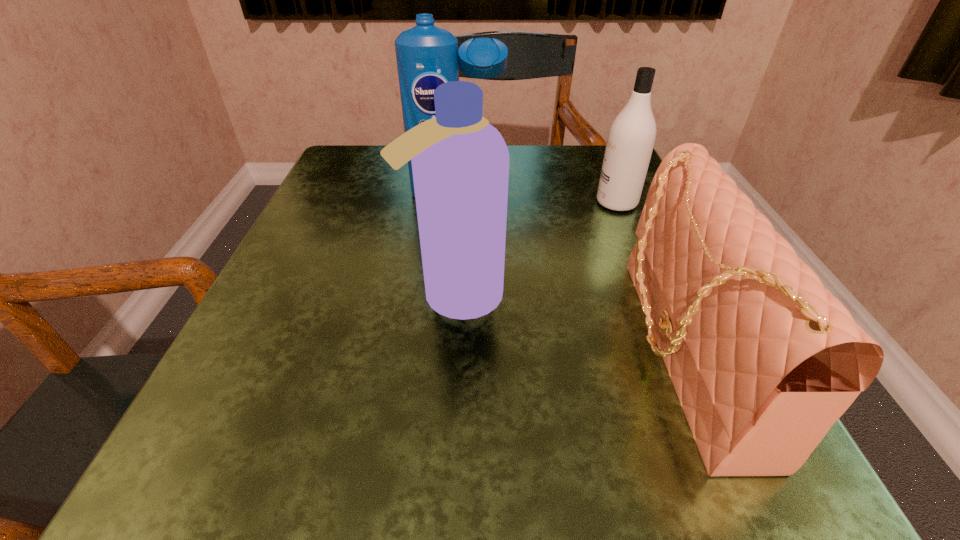
In the image, there is a desktop. At what (x,y) coordinates should I click in order to perform the action: click on vacant space at the near right corner. Please return your answer as a coordinate pair (x, y). This screenshot has height=540, width=960. Looking at the image, I should click on (647, 475).

I want to click on vacant space in between the nearest shampoo and the handbag, so click(567, 323).

At what (x,y) coordinates should I click in order to perform the action: click on the second closest object to the nearest shampoo. Please return your answer as a coordinate pair (x, y). Looking at the image, I should click on coord(427,56).

Choose which object is the second nearest neighbor to the rightmost shampoo. Please provide its 2D coordinates. Your answer should be formatted as a tuple, i.e. [(x, y)], where the tuple contains the x and y coordinates of a point satisfying the conditions above.

[(427, 56)]

You are a GUI agent. You are given a task and a screenshot of the screen. Output one action in this format:
    pyautogui.click(x=<x>, y=<y>)
    Task: Click on the third closest shampoo to the handbag
    The width and height of the screenshot is (960, 540).
    Given the screenshot: What is the action you would take?
    pyautogui.click(x=427, y=56)

The width and height of the screenshot is (960, 540). In order to click on shampoo that stands as the second closest to the nearest shampoo in this screenshot , I will do `click(631, 137)`.